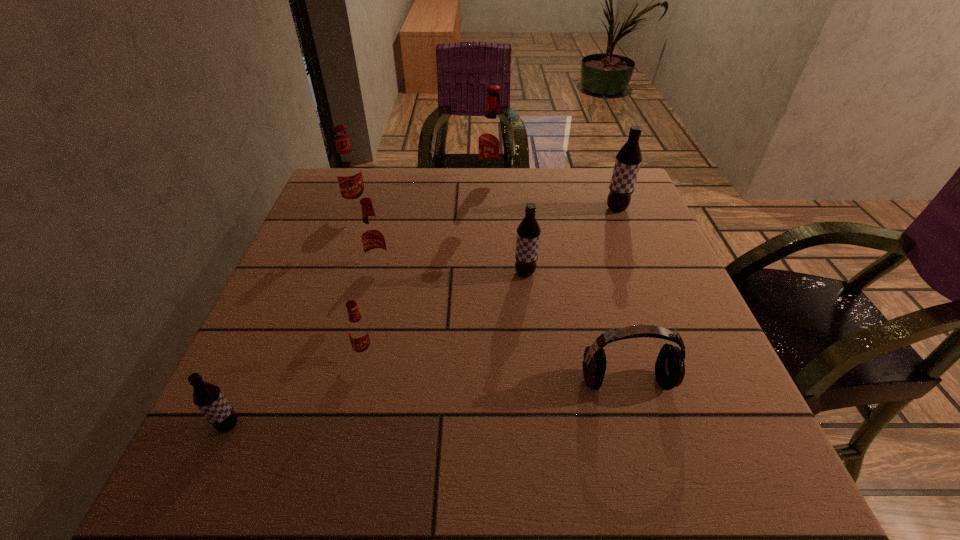
Identify which brown root beer is located as the nearest to the third biggest red root beer. Please provide its 2D coordinates. Your answer should be formatted as a tuple, i.e. [(x, y)], where the tuple contains the x and y coordinates of a point satisfying the conditions above.

[(528, 232)]